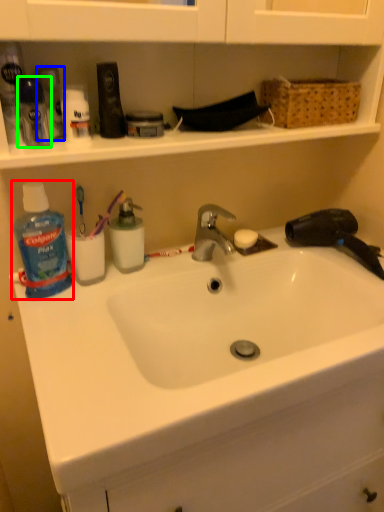
Question: Which object is positioned farthest from cleaning product (highlighted by a red box)? Select from toiletry (highlighted by a blue box) and toiletry (highlighted by a green box).

Choices:
 (A) toiletry
 (B) toiletry

Answer: (B)